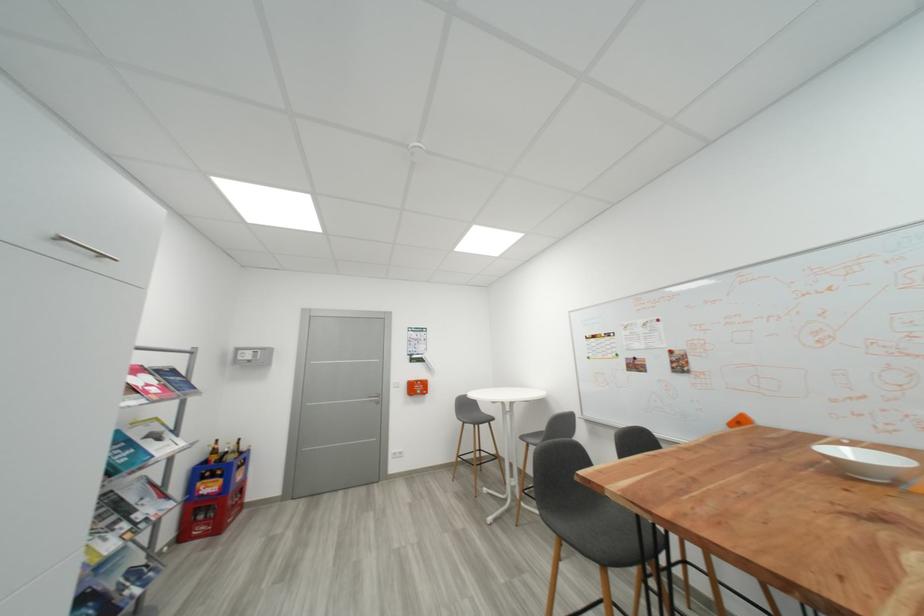
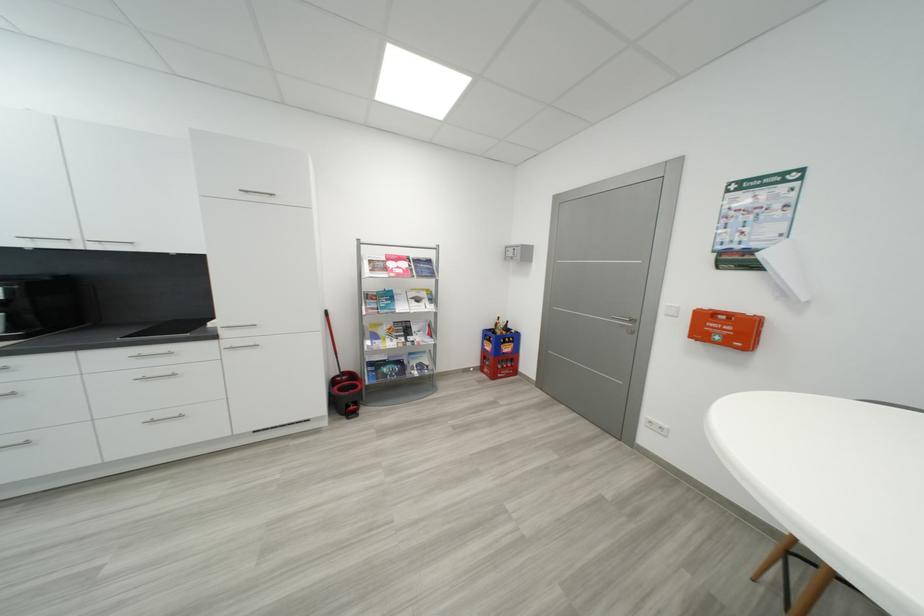
In the second image, find the point that corresponds to (139,392) in the first image.

(393, 270)